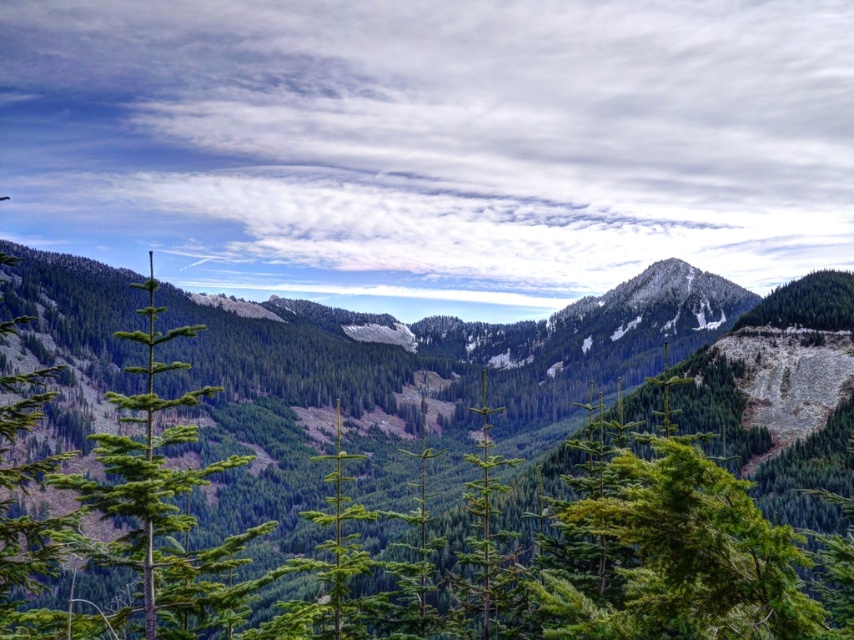
Who is positioned more to the right, green matte tree at center or green needle-like tree at left?

green matte tree at center

Between point (640, 595) and point (121, 460), which one is positioned behind?

Positioned behind is point (121, 460).

Which is behind, point (787, 563) or point (121, 493)?

The point (121, 493) is behind.

What are the coordinates of `green matte tree at center` in the screenshot? It's located at (662, 554).